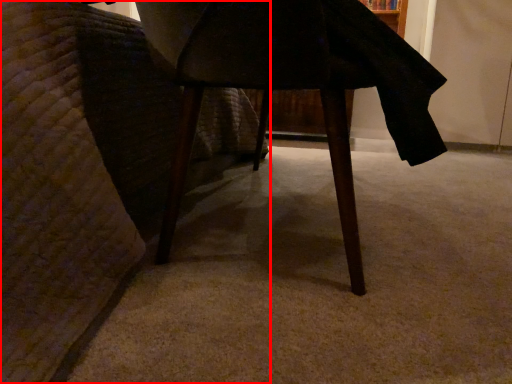
Question: Observing the image, what is the correct spatial positioning of furniture (annotated by the red box) in reference to table?

Choices:
 (A) right
 (B) left

Answer: (B)